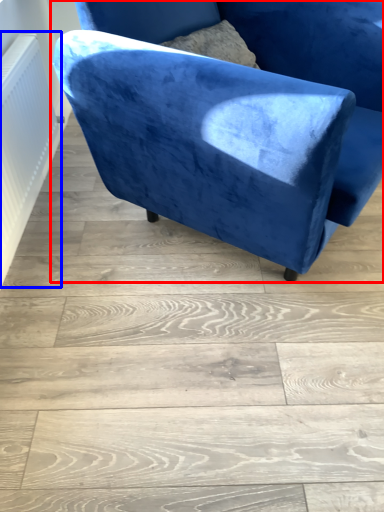
Question: Which object appears closest to the camera in this image, chair (highlighted by a red box) or radiator (highlighted by a blue box)?

Choices:
 (A) chair
 (B) radiator

Answer: (A)